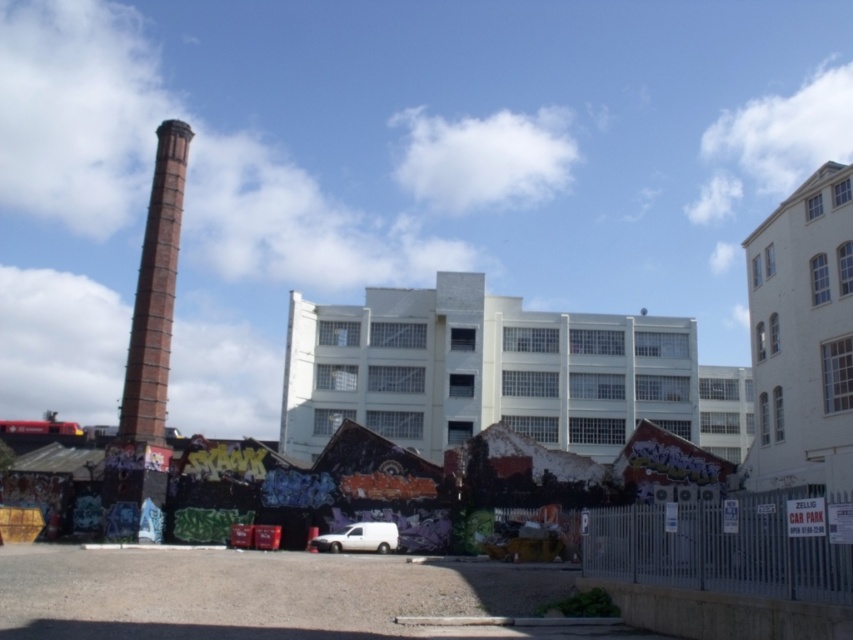
You are a delivery driver who needs to park your truck between the white matte building at center and the red brick chimney at left. Can you fit your truck between them if your truck is 3 meters wide?

The white matte building at center might be wider than the red brick chimney at left, but the exact width isn